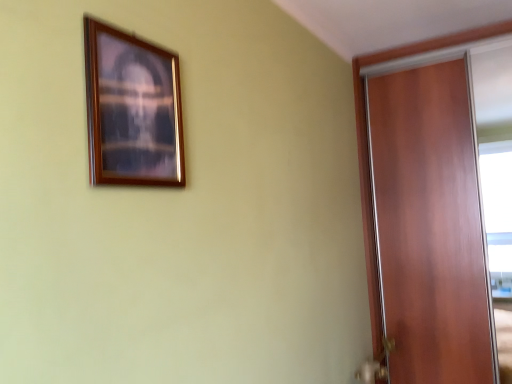
Question: Would you say gold metallic door handle at lower right is to the left or to the right of wooden door at right in the picture?

Choices:
 (A) left
 (B) right

Answer: (A)

Question: Considering the positions of point (373, 377) and point (430, 216), is point (373, 377) closer or farther from the camera than point (430, 216)?

Choices:
 (A) closer
 (B) farther

Answer: (A)

Question: Which object is the farthest from the wooden picture frame at upper left?

Choices:
 (A) gold metallic door handle at lower right
 (B) wooden door at right

Answer: (B)

Question: Considering the real-world distances, which object is farthest from the gold metallic door handle at lower right?

Choices:
 (A) wooden door at right
 (B) wooden picture frame at upper left

Answer: (B)